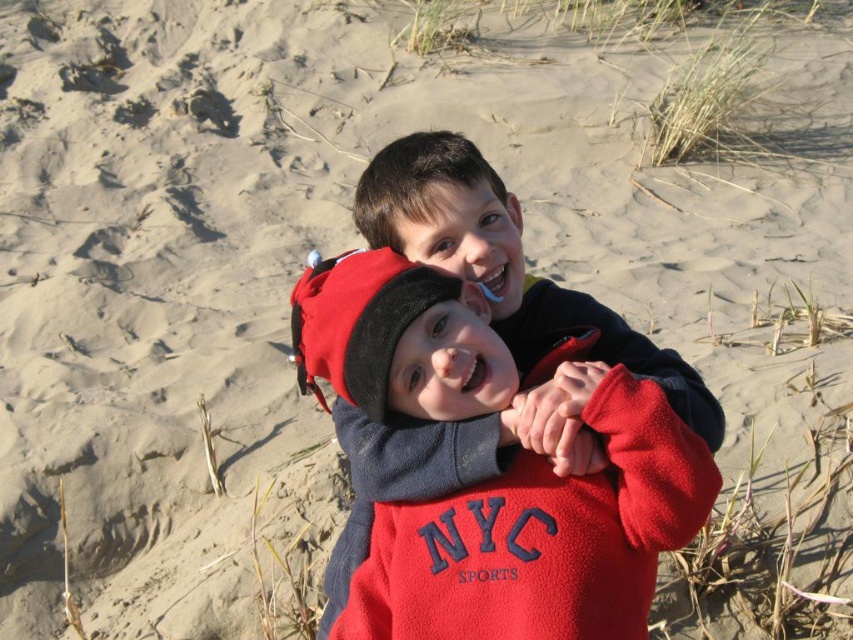
You are a photographer trying to capture both children in a single frame. Given that the red fleece sweatshirt at center is larger than the matte black jacket at center, which child should you position closer to the camera to ensure both appear equally sized in the photo?

To make both children appear equally sized in the photo, position the child wearing the matte black jacket at center closer to the camera since the red fleece sweatshirt at center is already larger in size.